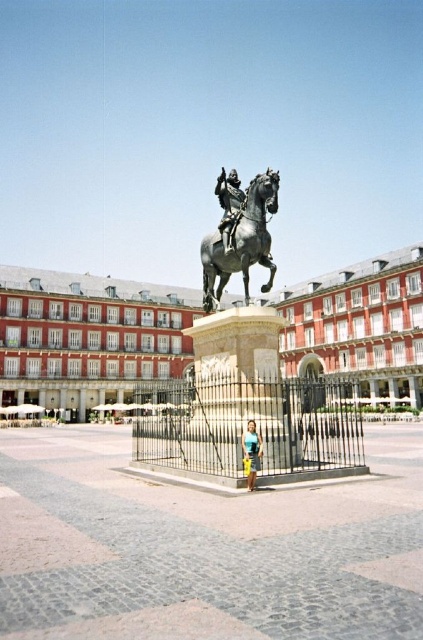
You are standing in the plaza looking at the equestrian statue. There is a specific point marked at coordinates (241, 241). Which part of the statue does this point correspond to?

The point at coordinates (241, 241) is on the bronze golden horse at center, so it corresponds to the horse part of the statue.

You are standing at point (246, 464) and want to move to point (222, 180). Given the layout of the plaza with the statue and fence, will you be moving forward or backward relative to your current position?

Since point (222, 180) is behind point (246, 464), moving from (246, 464) to (222, 180) would mean moving backward relative to your current position.